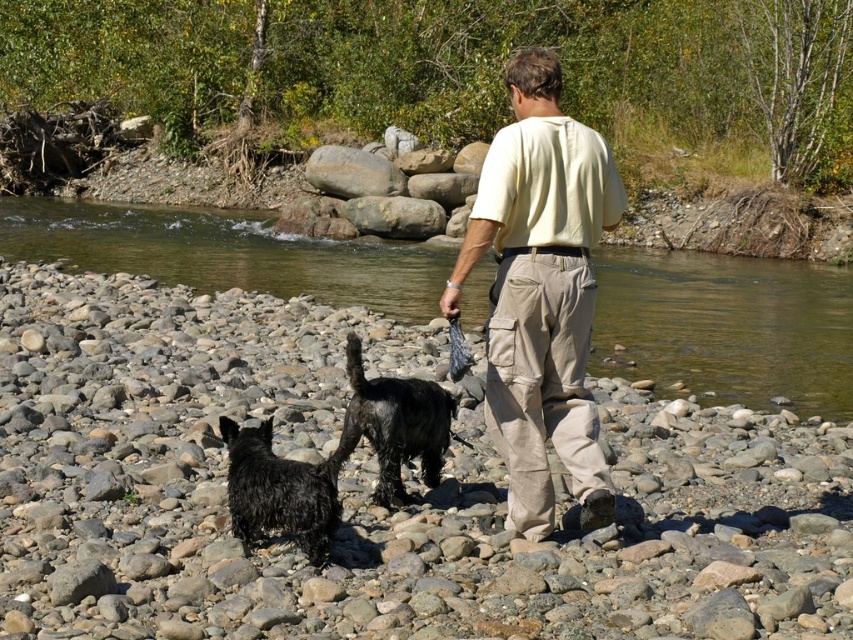
Is beige cotton shirt at center to the left of khaki cargo pants at center from the viewer's perspective?

Incorrect, beige cotton shirt at center is not on the left side of khaki cargo pants at center.

The height and width of the screenshot is (640, 853). I want to click on beige cotton shirt at center, so click(x=541, y=292).

What do you see at coordinates (541, 292) in the screenshot? The height and width of the screenshot is (640, 853). I see `beige cotton shirt at center` at bounding box center [541, 292].

You are a GUI agent. You are given a task and a screenshot of the screen. Output one action in this format:
    pyautogui.click(x=<x>, y=<y>)
    Task: Click on the beige cotton shirt at center
    
    Given the screenshot: What is the action you would take?
    pyautogui.click(x=541, y=292)

From the picture: Is beige cotton shirt at center positioned behind wet black fur at center?

Yes, beige cotton shirt at center is further from the viewer.

Does beige cotton shirt at center appear under wet black fur at center?

No, beige cotton shirt at center is not below wet black fur at center.

Is point (604, 170) more distant than point (428, 433)?

No, it is in front of (428, 433).

The width and height of the screenshot is (853, 640). In order to click on beige cotton shirt at center in this screenshot , I will do `click(541, 292)`.

Is point (819, 458) behind point (364, 420)?

Yes, it is.

Can you confirm if smooth pebbles at center is wider than wet black fur at center?

Indeed, smooth pebbles at center has a greater width compared to wet black fur at center.

Find the location of a particular element. smooth pebbles at center is located at coordinates (370, 490).